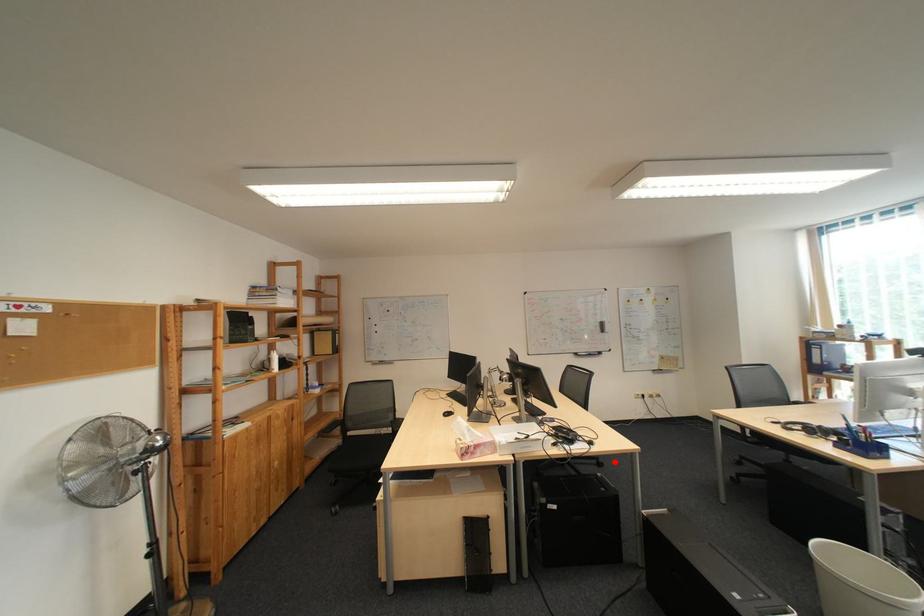
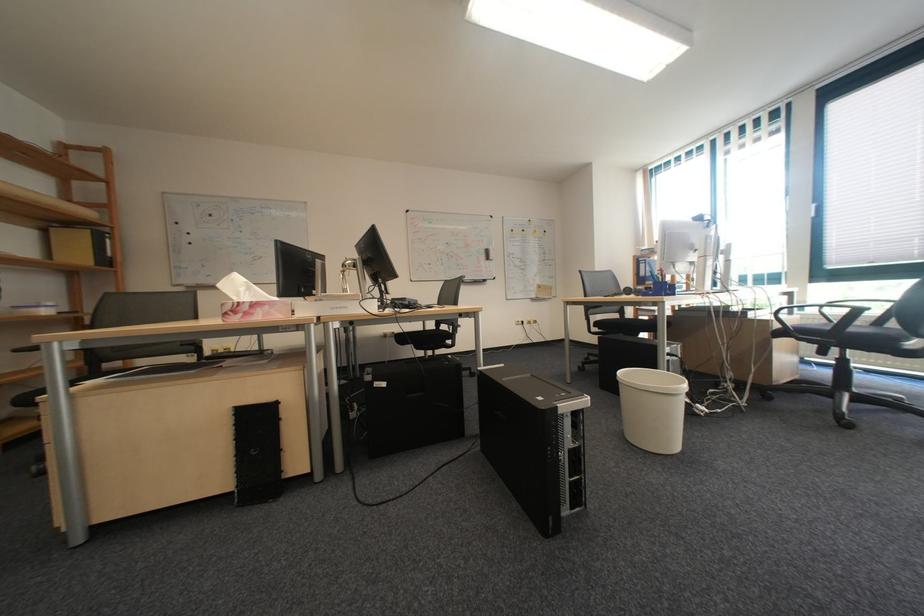
Where in the second image is the point corresponding to the highlighted location from the first image?

(487, 371)